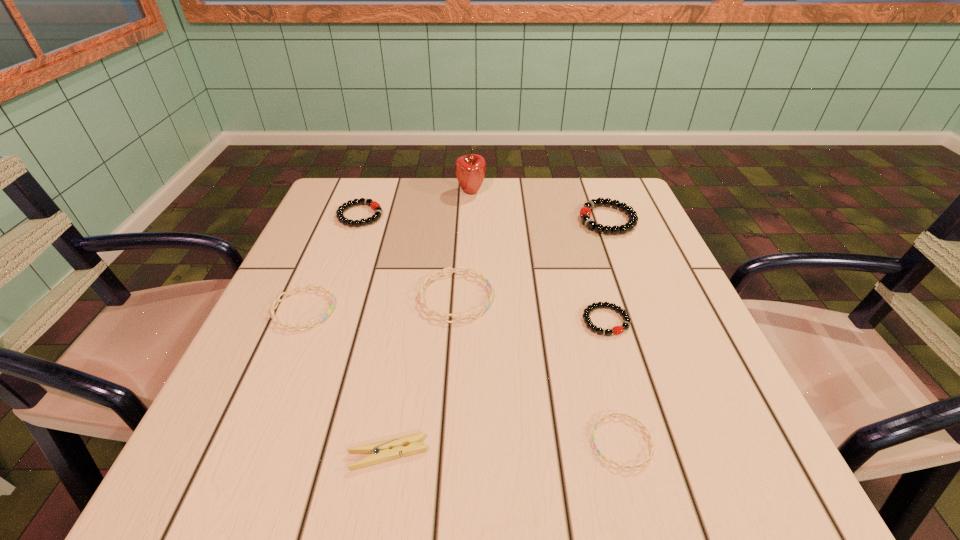
Where is `free spot at the far left corner of the desktop`? The image size is (960, 540). free spot at the far left corner of the desktop is located at coordinates (324, 212).

Where is `vacant space at the far right corner of the desktop`? This screenshot has height=540, width=960. vacant space at the far right corner of the desktop is located at coordinates (582, 206).

Find the location of a particular element. The width and height of the screenshot is (960, 540). vacant space at the near right corner of the desktop is located at coordinates (756, 496).

Find the location of a particular element. vacant space that is in between the apple and the second blue bracelet from left to right is located at coordinates (464, 245).

Locate an element on the screen. empty location between the smallest black bracelet and the shortest bracelet is located at coordinates (613, 382).

Identify the location of vacant point located between the second smallest blue bracelet and the second biggest black bracelet. Image resolution: width=960 pixels, height=540 pixels. (332, 262).

Identify the location of free space between the farthest object and the leftmost black bracelet. This screenshot has width=960, height=540. (416, 204).

Image resolution: width=960 pixels, height=540 pixels. I want to click on vacant area between the second smallest black bracelet and the nearest black bracelet, so click(x=483, y=268).

Find the location of a particular element. vacant space that's between the nearest black bracelet and the biggest black bracelet is located at coordinates (607, 271).

You are a GUI agent. You are given a task and a screenshot of the screen. Output one action in this format:
    pyautogui.click(x=<x>, y=<y>)
    Task: Click on the free area in between the clothespin and the leftmost blue bracelet
    The image size is (960, 540).
    Given the screenshot: What is the action you would take?
    pyautogui.click(x=346, y=381)